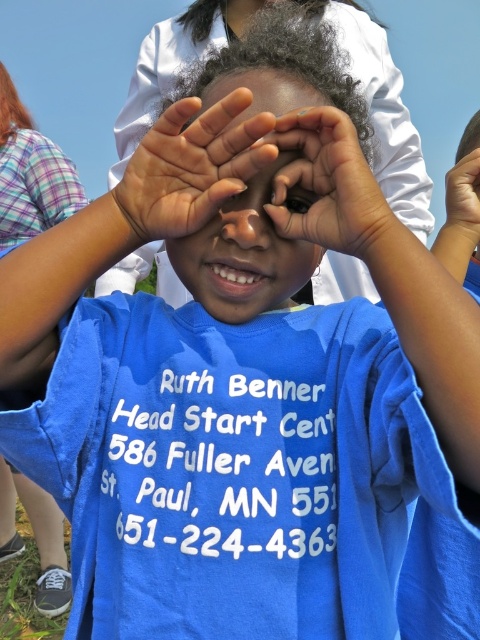
Question: Which point appears closest to the camera in this image?

Choices:
 (A) (212, 141)
 (B) (245, 77)

Answer: (A)

Question: Is smooth skin face at center positioned at the back of smooth skin hand at upper right?

Choices:
 (A) yes
 (B) no

Answer: (B)

Question: Is blue cotton shirt at center bigger than smooth skin hand at upper right?

Choices:
 (A) no
 (B) yes

Answer: (B)

Question: Which object is positioned farthest from the palm skin at center?

Choices:
 (A) black matte eye at center
 (B) blue cotton shirt at center
 (C) smooth skin hand at upper right

Answer: (B)

Question: Which point is closer to the camera?

Choices:
 (A) matte skin hand at center
 (B) black matte eye at center
 (C) blue cotton shirt at center

Answer: (A)

Question: Does palm skin at center lie behind smooth skin hand at upper right?

Choices:
 (A) no
 (B) yes

Answer: (A)